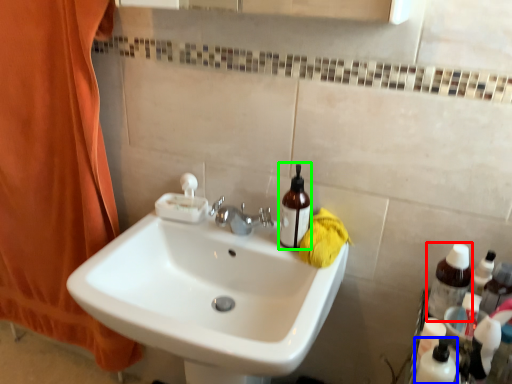
Question: Estimate the real-world distances between objects in this image. Which object is farther from bottle (highlighted by a red box), toiletry (highlighted by a blue box) or mouthwash (highlighted by a green box)?

Choices:
 (A) toiletry
 (B) mouthwash

Answer: (B)